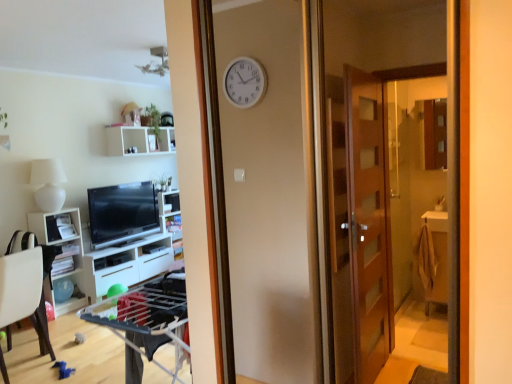
Question: Considering the relative sizes of white matte lamp at left and white plastic chair at lower left in the image provided, is white matte lamp at left shorter than white plastic chair at lower left?

Choices:
 (A) yes
 (B) no

Answer: (A)

Question: Can white plastic chair at lower left be found inside white matte lamp at left?

Choices:
 (A) yes
 (B) no

Answer: (B)

Question: Is white matte lamp at left thinner than white plastic chair at lower left?

Choices:
 (A) yes
 (B) no

Answer: (A)

Question: Considering the relative sizes of white matte lamp at left and white plastic chair at lower left in the image provided, is white matte lamp at left wider than white plastic chair at lower left?

Choices:
 (A) no
 (B) yes

Answer: (A)

Question: Can you confirm if white matte lamp at left is positioned to the right of white plastic chair at lower left?

Choices:
 (A) yes
 (B) no

Answer: (B)

Question: Does white matte lamp at left turn towards white plastic chair at lower left?

Choices:
 (A) no
 (B) yes

Answer: (A)

Question: From the image's perspective, does white glossy shelf at center, which appears as the second shelf when viewed from the top, appear lower than white matte lamp at left?

Choices:
 (A) no
 (B) yes

Answer: (B)

Question: Could you tell me if white glossy shelf at center, which is the second shelf from bottom to top, is turned towards white matte lamp at left?

Choices:
 (A) yes
 (B) no

Answer: (B)

Question: Is white glossy shelf at center, which appears as the second shelf when viewed from the top, to the right of white matte lamp at left from the viewer's perspective?

Choices:
 (A) yes
 (B) no

Answer: (A)

Question: Is white glossy shelf at center, which is the second shelf from bottom to top, positioned with its back to white matte lamp at left?

Choices:
 (A) yes
 (B) no

Answer: (B)

Question: Can white matte lamp at left be found inside white glossy shelf at center, which appears as the second shelf when viewed from the top?

Choices:
 (A) no
 (B) yes

Answer: (A)

Question: From the image's perspective, is white glossy shelf at center, which is the second shelf from bottom to top, on white matte lamp at left?

Choices:
 (A) yes
 (B) no

Answer: (B)

Question: Is the depth of white plastic chair at lower left greater than that of white glossy cabinet at left, which is counted as the second cabinetry, starting from the back?

Choices:
 (A) yes
 (B) no

Answer: (B)